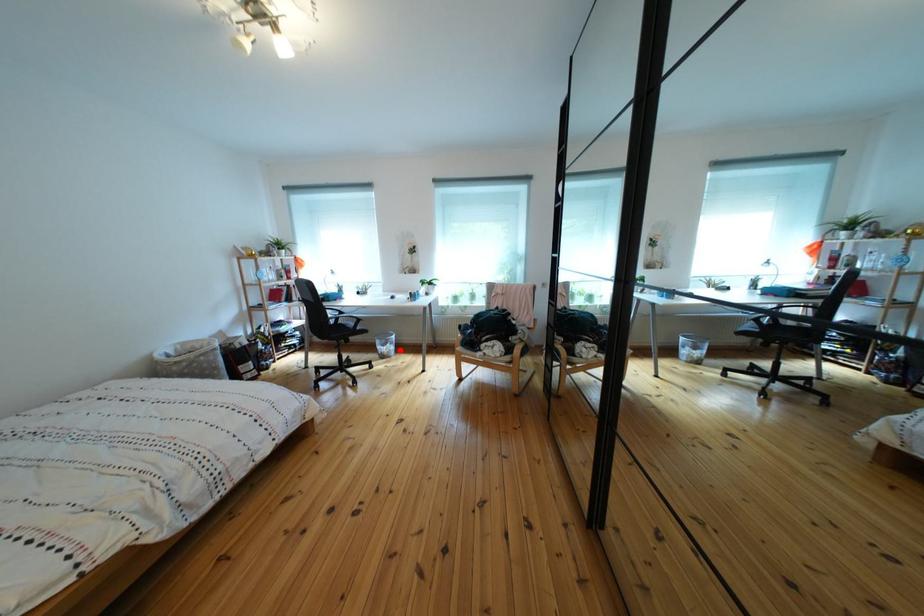
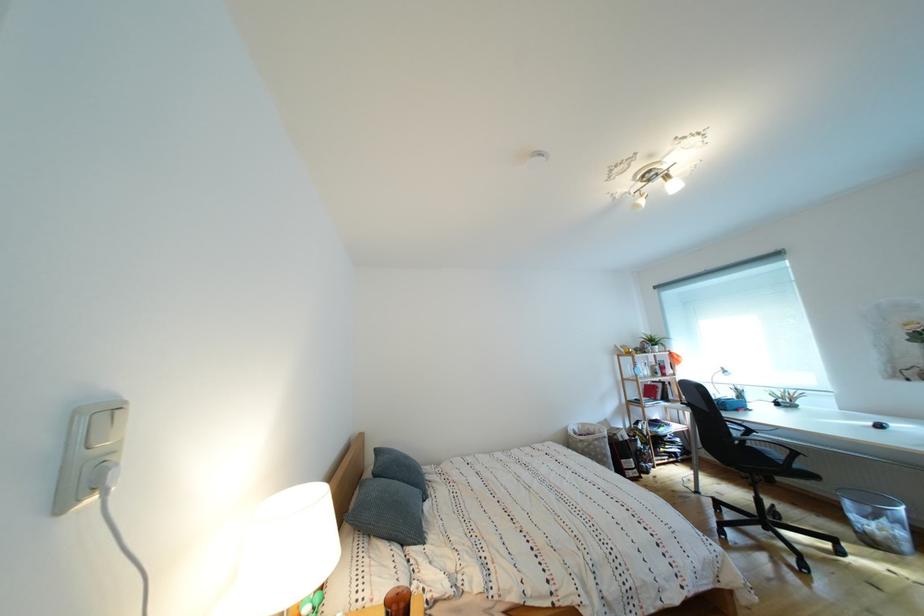
In the second image, find the point that corresponds to the highlighted location in the first image.

(896, 527)